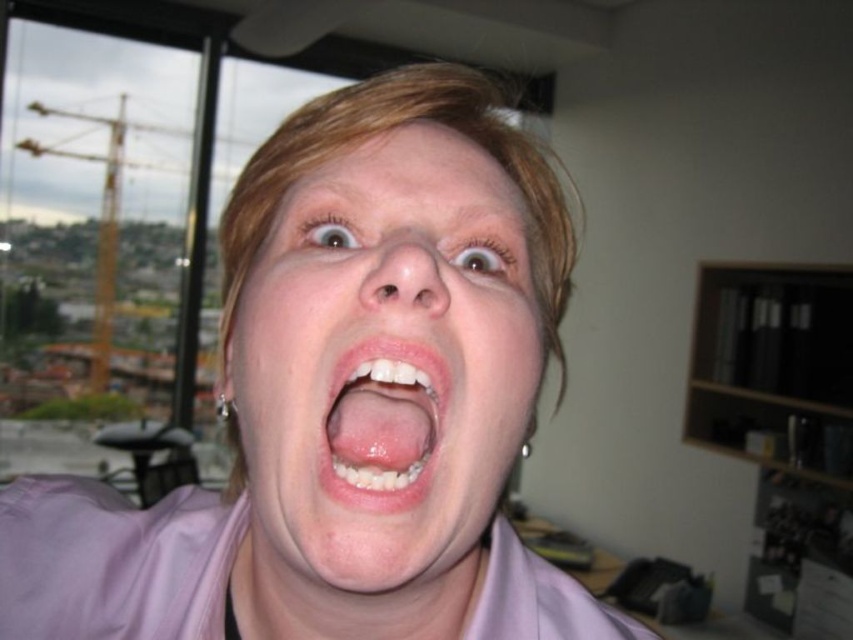
Is pink satin shirt at center shorter than smooth skin face at center?

No.

Can you confirm if pink satin shirt at center is wider than smooth skin face at center?

Indeed, pink satin shirt at center has a greater width compared to smooth skin face at center.

In order to click on pink satin shirt at center in this screenshot , I will do `click(346, 401)`.

Does point (282, 624) come behind point (402, 352)?

Yes, point (282, 624) is behind point (402, 352).

Between pink satin shirt at center and pink glossy lips at center, which one is positioned higher?

pink glossy lips at center is above.

Is point (132, 532) in front of point (360, 492)?

No.

Locate an element on the screen. This screenshot has height=640, width=853. pink satin shirt at center is located at coordinates (346, 401).

Can you confirm if smooth skin face at center is positioned below pink glossy lips at center?

No, smooth skin face at center is not below pink glossy lips at center.

Does smooth skin face at center have a smaller size compared to pink glossy lips at center?

No, smooth skin face at center is not smaller than pink glossy lips at center.

The width and height of the screenshot is (853, 640). Identify the location of smooth skin face at center. (383, 369).

This screenshot has height=640, width=853. I want to click on smooth skin face at center, so click(383, 369).